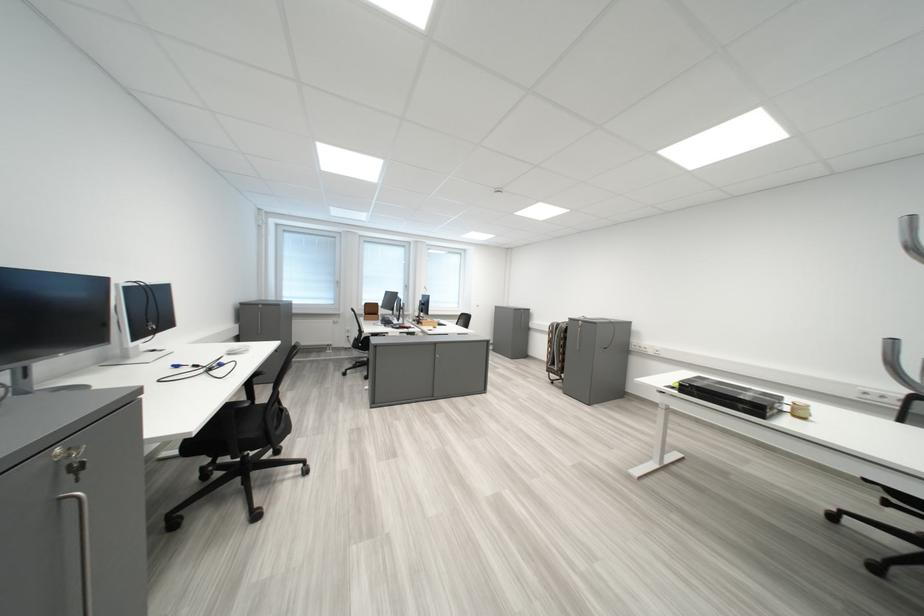
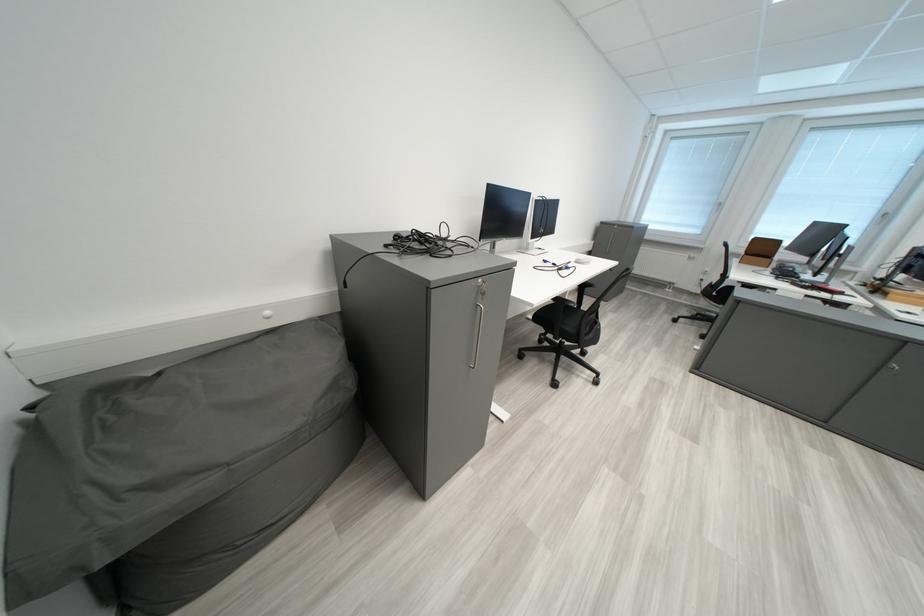
The point at (380, 306) is marked in the first image. Where is the corresponding point in the second image?

(769, 241)